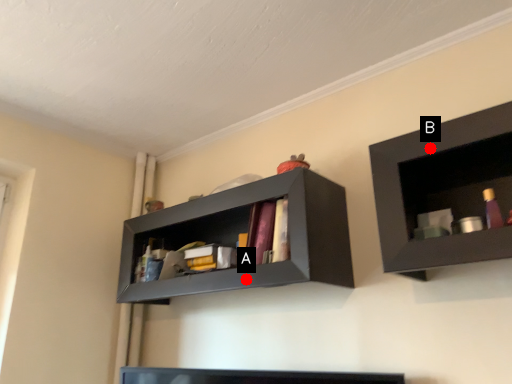
Question: Two points are circled on the image, labeled by A and B beside each circle. Which point is closer to the camera?

Choices:
 (A) A is closer
 (B) B is closer

Answer: (B)